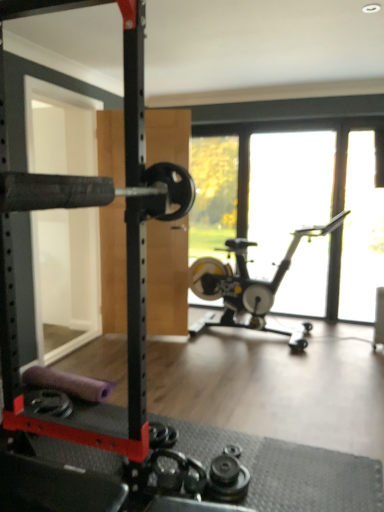
Question: Is black rubber barbell at left a part of transparent glass window at center?

Choices:
 (A) no
 (B) yes

Answer: (A)

Question: Does transparent glass window at center have a greater width compared to black rubber barbell at left?

Choices:
 (A) no
 (B) yes

Answer: (A)

Question: From a real-world perspective, is transparent glass window at center physically above black rubber barbell at left?

Choices:
 (A) yes
 (B) no

Answer: (B)

Question: From a real-world perspective, is transparent glass window at center below black rubber barbell at left?

Choices:
 (A) yes
 (B) no

Answer: (A)

Question: Is transparent glass window at center smaller than black rubber barbell at left?

Choices:
 (A) yes
 (B) no

Answer: (A)

Question: Is transparent glass window at center shorter than black rubber barbell at left?

Choices:
 (A) no
 (B) yes

Answer: (B)

Question: Is transparent glass window at center turned away from silver metallic stationary bicycle at center?

Choices:
 (A) no
 (B) yes

Answer: (B)

Question: Is transparent glass window at center oriented towards silver metallic stationary bicycle at center?

Choices:
 (A) yes
 (B) no

Answer: (A)

Question: Can you confirm if transparent glass window at center is wider than silver metallic stationary bicycle at center?

Choices:
 (A) no
 (B) yes

Answer: (A)

Question: From a real-world perspective, does transparent glass window at center stand above silver metallic stationary bicycle at center?

Choices:
 (A) no
 (B) yes

Answer: (B)

Question: From a real-world perspective, does transparent glass window at center sit lower than silver metallic stationary bicycle at center?

Choices:
 (A) yes
 (B) no

Answer: (B)

Question: Is transparent glass window at center positioned behind silver metallic stationary bicycle at center?

Choices:
 (A) yes
 (B) no

Answer: (A)

Question: Is transparent glass window screen at right looking in the opposite direction of silver metallic stationary bicycle at center?

Choices:
 (A) no
 (B) yes

Answer: (A)